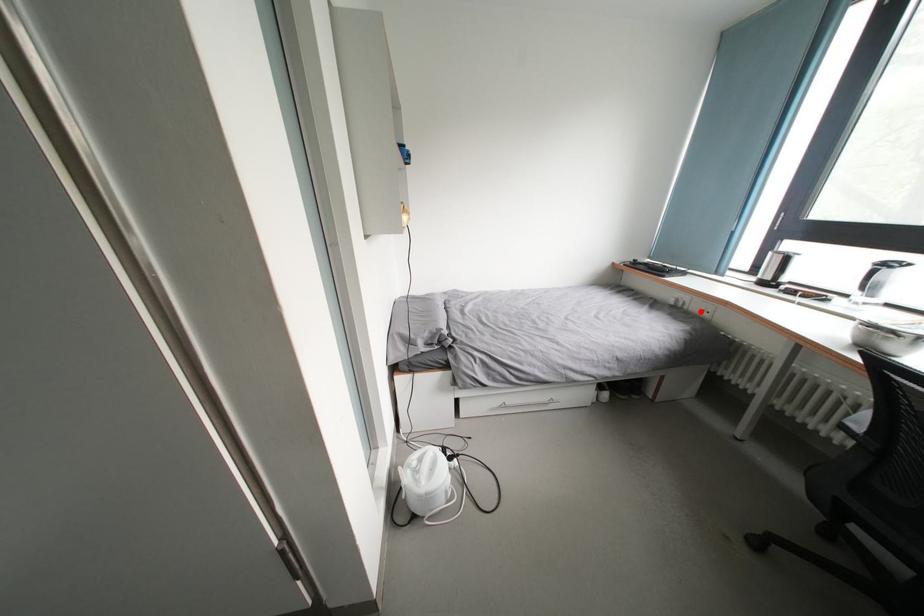
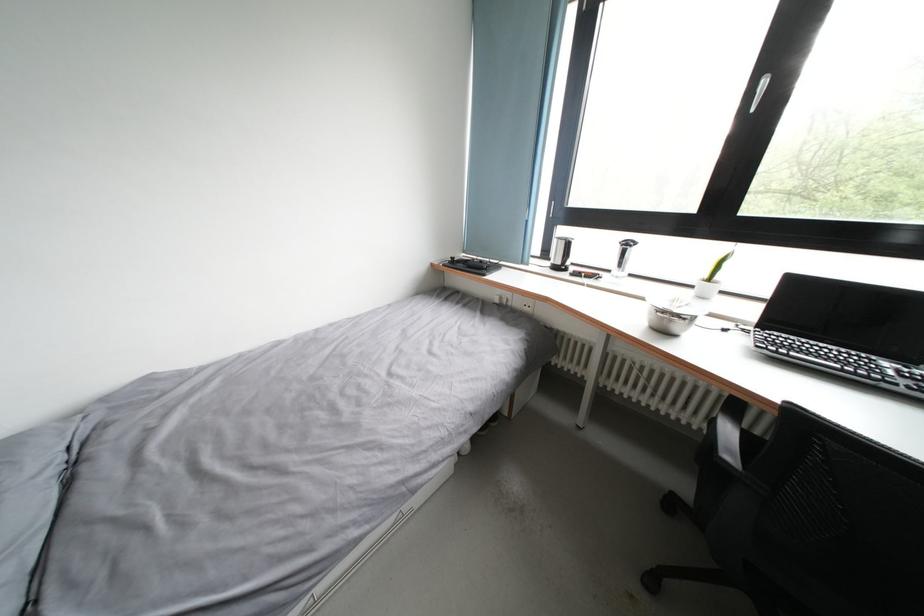
In the second image, find the point that corresponds to the highlighted location in the first image.

(524, 308)